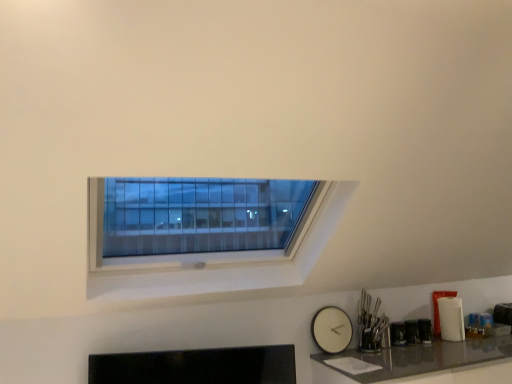
Question: Considering the positions of shiny gray countertop at lower right and white matte clock at lower right in the image, is shiny gray countertop at lower right bigger or smaller than white matte clock at lower right?

Choices:
 (A) big
 (B) small

Answer: (A)

Question: From the image's perspective, is shiny gray countertop at lower right positioned above or below white matte clock at lower right?

Choices:
 (A) below
 (B) above

Answer: (A)

Question: Is shiny gray countertop at lower right inside the boundaries of white matte clock at lower right, or outside?

Choices:
 (A) inside
 (B) outside

Answer: (B)

Question: Looking at the image, does white matte clock at lower right seem bigger or smaller compared to shiny gray countertop at lower right?

Choices:
 (A) small
 (B) big

Answer: (A)

Question: Considering the positions of point (320, 331) and point (344, 372), is point (320, 331) closer or farther from the camera than point (344, 372)?

Choices:
 (A) farther
 (B) closer

Answer: (A)

Question: From the image's perspective, is white matte clock at lower right positioned above or below shiny gray countertop at lower right?

Choices:
 (A) below
 (B) above

Answer: (B)

Question: From their relative heights in the image, would you say white matte clock at lower right is taller or shorter than shiny gray countertop at lower right?

Choices:
 (A) tall
 (B) short

Answer: (B)